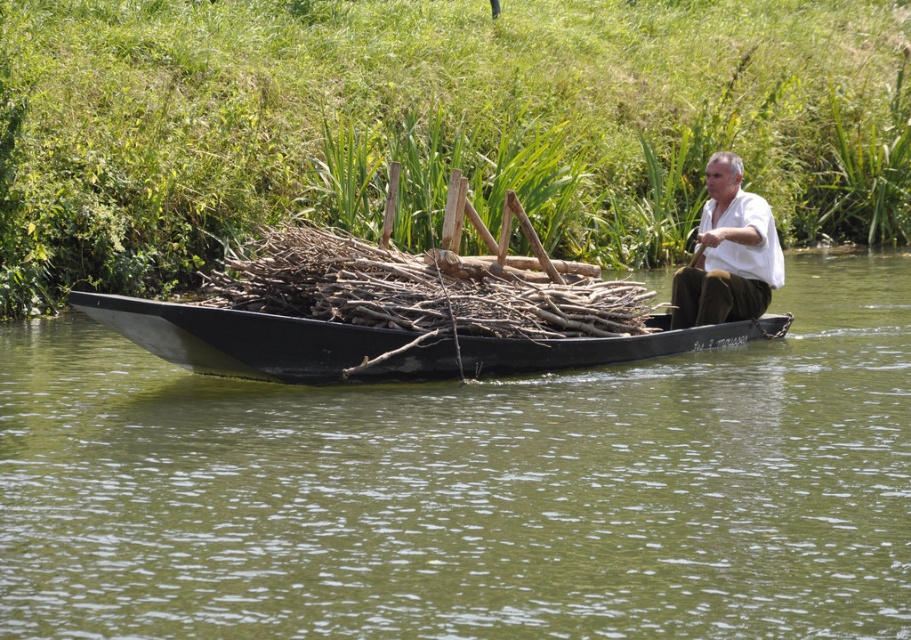
Question: Which object appears farthest from the camera in this image?

Choices:
 (A) black matte canoe at center
 (B) brown rough wood at center
 (C) white matte shirt at upper center

Answer: (C)

Question: Does green water at boat center have a smaller size compared to brown rough wood at center?

Choices:
 (A) yes
 (B) no

Answer: (B)

Question: Does green water at boat center have a lesser width compared to green grass at upper center?

Choices:
 (A) no
 (B) yes

Answer: (B)

Question: Does brown rough wood at center have a larger size compared to black matte canoe at center?

Choices:
 (A) yes
 (B) no

Answer: (B)

Question: Estimate the real-world distances between objects in this image. Which object is farther from the green grass at upper center?

Choices:
 (A) black matte canoe at center
 (B) white matte shirt at upper center

Answer: (B)

Question: Which object is the farthest from the green grass at upper center?

Choices:
 (A) white matte shirt at upper center
 (B) black matte canoe at center
 (C) green water at boat center
 (D) brown rough wood at center

Answer: (D)